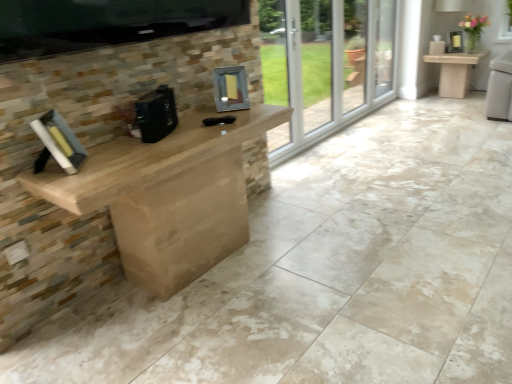
Question: Considering the relative sizes of black matte coffee machine at center, arranged as the second appliance when viewed from the right, and metallic silver frame at center, which is the second appliance in left-to-right order, in the image provided, is black matte coffee machine at center, arranged as the second appliance when viewed from the right, shorter than metallic silver frame at center, which is the second appliance in left-to-right order,?

Choices:
 (A) no
 (B) yes

Answer: (B)

Question: Is black matte coffee machine at center, which is the 1th appliance from left to right, turned away from metallic silver frame at center, acting as the 1th appliance starting from the right?

Choices:
 (A) yes
 (B) no

Answer: (B)

Question: Would you consider black matte coffee machine at center, positioned as the second appliance in back-to-front order, to be distant from metallic silver frame at center, which appears as the 1th appliance when viewed from the back?

Choices:
 (A) no
 (B) yes

Answer: (A)

Question: Does black matte coffee machine at center, arranged as the second appliance when viewed from the right, turn towards metallic silver frame at center, which is the second appliance in left-to-right order?

Choices:
 (A) no
 (B) yes

Answer: (A)

Question: Is black matte coffee machine at center, arranged as the second appliance when viewed from the right, outside metallic silver frame at center, which is the second appliance in left-to-right order?

Choices:
 (A) no
 (B) yes

Answer: (B)

Question: Choose the correct answer: Is metallic silver frame at center, acting as the 1th appliance starting from the right, inside black matte coffee machine at center, which is the 1th appliance from left to right, or outside it?

Choices:
 (A) inside
 (B) outside

Answer: (B)

Question: Looking at their shapes, would you say metallic silver frame at center, which appears as the 1th appliance when viewed from the back, is wider or thinner than black matte coffee machine at center, positioned as the first appliance in front-to-back order?

Choices:
 (A) thin
 (B) wide

Answer: (B)

Question: In terms of height, does metallic silver frame at center, the 2th appliance in the front-to-back sequence, look taller or shorter compared to black matte coffee machine at center, which is the 1th appliance from left to right?

Choices:
 (A) tall
 (B) short

Answer: (A)

Question: Based on their sizes in the image, would you say metallic silver frame at center, acting as the 1th appliance starting from the right, is bigger or smaller than black matte coffee machine at center, positioned as the second appliance in back-to-front order?

Choices:
 (A) big
 (B) small

Answer: (B)

Question: Considering their positions, is metallic silver frame at center, which appears as the 1th appliance when viewed from the back, located in front of or behind hardcover book at left?

Choices:
 (A) front
 (B) behind

Answer: (B)

Question: From the image's perspective, is metallic silver frame at center, which appears as the 1th appliance when viewed from the back, above or below hardcover book at left?

Choices:
 (A) below
 (B) above

Answer: (B)

Question: In terms of width, does metallic silver frame at center, acting as the 1th appliance starting from the right, look wider or thinner when compared to hardcover book at left?

Choices:
 (A) wide
 (B) thin

Answer: (B)

Question: Is metallic silver frame at center, which appears as the 1th appliance when viewed from the back, bigger or smaller than hardcover book at left?

Choices:
 (A) big
 (B) small

Answer: (B)

Question: Considering the positions of hardcover book at left and matte stone table at right in the image, is hardcover book at left wider or thinner than matte stone table at right?

Choices:
 (A) wide
 (B) thin

Answer: (B)

Question: Choose the correct answer: Is hardcover book at left inside matte stone table at right or outside it?

Choices:
 (A) outside
 (B) inside

Answer: (A)